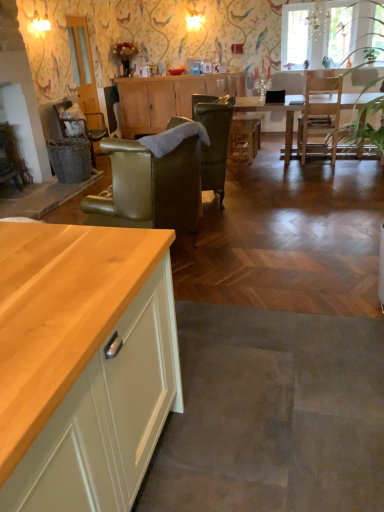
Question: Is point (195, 113) closer or farther from the camera than point (77, 117)?

Choices:
 (A) farther
 (B) closer

Answer: (B)

Question: Which is correct: leather armchair at center, positioned as the second chair in front-to-back order, is inside rattan wicker chair at center, the 1th chair viewed from the back, or outside of it?

Choices:
 (A) outside
 (B) inside

Answer: (A)

Question: Which object is positioned farthest from the leather armchair at center, which ranks as the second chair in back-to-front order?

Choices:
 (A) wooden cabinet at center
 (B) matte orange bowl at center
 (C) transparent glass window at upper center
 (D) rattan wicker chair at center, the 1th chair viewed from the back
 (E) light brown wooden table at center

Answer: (C)

Question: Estimate the real-world distances between objects in this image. Which object is closer to the clear glass door at upper left?

Choices:
 (A) light brown wooden table at center
 (B) leather armchair at center, placed as the 3th chair when sorted from left to right
 (C) rattan wicker chair at center, the 1th chair when ordered from left to right
 (D) wooden counter at lower left
 (E) wooden cabinet at center

Answer: (C)